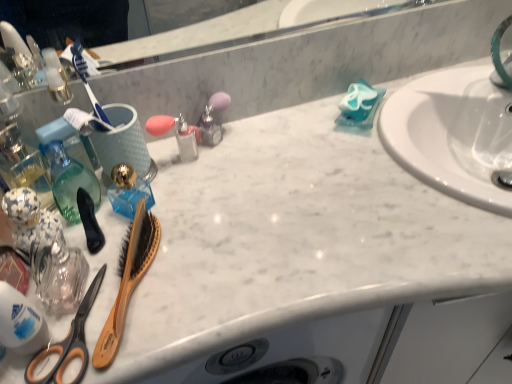
Describe the element at coordinates (213, 119) in the screenshot. The height and width of the screenshot is (384, 512). I see `translucent purple bottle at center` at that location.

The height and width of the screenshot is (384, 512). What do you see at coordinates (68, 334) in the screenshot?
I see `orange-handled scissors at lower left` at bounding box center [68, 334].

Locate an element on the screen. The width and height of the screenshot is (512, 384). translucent plastic bottle at lower left, the first cleaning product positioned from the left is located at coordinates (20, 322).

How much space does blue matte soap at upper right, which appears as the 1th cleaning product when viewed from the back, occupy horizontally?

blue matte soap at upper right, which appears as the 1th cleaning product when viewed from the back, is 5.23 inches in width.

The width and height of the screenshot is (512, 384). Identify the location of translucent purple bottle at center. (213, 119).

Is the position of translucent blue glass at center more distant than that of translucent plastic bottle at lower left, arranged as the 2th cleaning product when viewed from the back?

That is True.

Is translucent blue glass at center inside the boundaries of translucent plastic bottle at lower left, positioned as the 1th cleaning product in bottom-to-top order, or outside?

The correct answer is: outside.

Is translucent blue glass at center far from translucent plastic bottle at lower left, positioned as the 1th cleaning product in bottom-to-top order?

Actually, translucent blue glass at center and translucent plastic bottle at lower left, positioned as the 1th cleaning product in bottom-to-top order, are a little close together.

Considering the relative positions of translucent blue glass at center and translucent plastic bottle at lower left, the first cleaning product positioned from the left, in the image provided, is translucent blue glass at center to the left of translucent plastic bottle at lower left, the first cleaning product positioned from the left, from the viewer's perspective?

No.

From a real-world perspective, is wooden bristle brush at left, which ranks as the 2th brush in left-to-right order, positioned under translucent plastic bottle at lower left, acting as the first cleaning product starting from the front, based on gravity?

Correct, in the physical world, wooden bristle brush at left, which ranks as the 2th brush in left-to-right order, is lower than translucent plastic bottle at lower left, acting as the first cleaning product starting from the front.

From the image's perspective, does wooden bristle brush at left, which ranks as the 2th brush in left-to-right order, appear lower than translucent plastic bottle at lower left, arranged as the 2th cleaning product when viewed from the back?

Actually, wooden bristle brush at left, which ranks as the 2th brush in left-to-right order, appears above translucent plastic bottle at lower left, arranged as the 2th cleaning product when viewed from the back, in the image.

Considering the positions of point (120, 311) and point (41, 344), is point (120, 311) closer or farther from the camera than point (41, 344)?

Clearly, point (120, 311) is more distant from the camera than point (41, 344).

Which of these two, wooden bristle brush at left, the first brush when ordered from right to left, or translucent plastic bottle at lower left, which is counted as the 2th cleaning product, starting from the right, is bigger?

Bigger between the two is wooden bristle brush at left, the first brush when ordered from right to left.

Does point (18, 308) come farther from viewer compared to point (358, 123)?

No, (18, 308) is in front of (358, 123).

Is translucent plastic bottle at lower left, acting as the first cleaning product starting from the front, in contact with blue matte soap at upper right, the 1th cleaning product positioned from the top?

No, translucent plastic bottle at lower left, acting as the first cleaning product starting from the front, is not making contact with blue matte soap at upper right, the 1th cleaning product positioned from the top.

Who is smaller, translucent plastic bottle at lower left, arranged as the 2th cleaning product when viewed from the back, or blue matte soap at upper right, which appears as the 1th cleaning product when viewed from the back?

With smaller size is translucent plastic bottle at lower left, arranged as the 2th cleaning product when viewed from the back.

From a real-world perspective, is translucent blue glass at center under wooden bristle brush at left, which ranks as the 2th brush in left-to-right order?

Actually, translucent blue glass at center is physically above wooden bristle brush at left, which ranks as the 2th brush in left-to-right order, in the real world.

From the image's perspective, which is below, translucent blue glass at center or wooden bristle brush at left, the first brush when ordered from right to left?

From the image's view, wooden bristle brush at left, the first brush when ordered from right to left, is below.

Considering the sizes of objects translucent blue glass at center and wooden bristle brush at left, which ranks as the 2th brush in left-to-right order, in the image provided, who is smaller, translucent blue glass at center or wooden bristle brush at left, which ranks as the 2th brush in left-to-right order,?

With smaller size is translucent blue glass at center.

Which of these two, translucent blue glass at center or wooden bristle brush at left, the first brush when ordered from right to left, stands shorter?

With less height is wooden bristle brush at left, the first brush when ordered from right to left.

Which is behind, point (39, 358) or point (353, 121)?

The point (353, 121) is farther from the camera.

Does orange-handled scissors at lower left have a lesser height compared to blue matte soap at upper right, which appears as the 1th cleaning product when viewed from the back?

Indeed, orange-handled scissors at lower left has a lesser height compared to blue matte soap at upper right, which appears as the 1th cleaning product when viewed from the back.

Where is `scissors on the left of the blue matte soap at upper right, the second cleaning product from the bottom`? scissors on the left of the blue matte soap at upper right, the second cleaning product from the bottom is located at coordinates (68, 334).

Is wooden bristle brush at left, which ranks as the 2th brush in left-to-right order, facing away from translucent glass bottle at left?

Yes.

Considering the relative positions of wooden bristle brush at left, the first brush when ordered from right to left, and translucent glass bottle at left in the image provided, is wooden bristle brush at left, the first brush when ordered from right to left, to the right of translucent glass bottle at left from the viewer's perspective?

Yes, wooden bristle brush at left, the first brush when ordered from right to left, is to the right of translucent glass bottle at left.

Image resolution: width=512 pixels, height=384 pixels. What are the coordinates of `brush that is the 2nd object directly below the translucent glass bottle at left (from a real-world perspective)` in the screenshot? It's located at 128,280.

Looking at the image, does wooden bristle brush at left, the first brush when ordered from right to left, seem bigger or smaller compared to translucent glass bottle at left?

In the image, wooden bristle brush at left, the first brush when ordered from right to left, appears to be larger than translucent glass bottle at left.

Can translucent plastic bottle at lower left, which is counted as the 2th cleaning product, starting from the right, be found inside orange-handled scissors at lower left?

No, translucent plastic bottle at lower left, which is counted as the 2th cleaning product, starting from the right, is not surrounded by orange-handled scissors at lower left.

Could you measure the distance between orange-handled scissors at lower left and translucent plastic bottle at lower left, which is counted as the 2th cleaning product, starting from the right?

orange-handled scissors at lower left and translucent plastic bottle at lower left, which is counted as the 2th cleaning product, starting from the right, are 1.90 inches apart from each other.

Which object is further away from the camera, orange-handled scissors at lower left or translucent plastic bottle at lower left, arranged as the 2th cleaning product when viewed from the back?

orange-handled scissors at lower left is further away from the camera.

Considering the relative positions of orange-handled scissors at lower left and translucent plastic bottle at lower left, which ranks as the 2th cleaning product in top-to-bottom order, in the image provided, is orange-handled scissors at lower left to the left of translucent plastic bottle at lower left, which ranks as the 2th cleaning product in top-to-bottom order, from the viewer's perspective?

No.

Where is `mouthwash located underneath the translucent plastic bottle at lower left, acting as the first cleaning product starting from the front (from a real-world perspective)`? This screenshot has width=512, height=384. mouthwash located underneath the translucent plastic bottle at lower left, acting as the first cleaning product starting from the front (from a real-world perspective) is located at coordinates tap(128, 191).

Where is `cleaning product located on the left of wooden bristle brush at left, the first brush when ordered from right to left`? This screenshot has width=512, height=384. cleaning product located on the left of wooden bristle brush at left, the first brush when ordered from right to left is located at coordinates (20, 322).

Looking at this image, looking at the image, which one is located closer to wooden bristle brush at left, which ranks as the 2th brush in left-to-right order, translucent purple bottle at center or translucent blue glass at center?

Among the two, translucent blue glass at center is located nearer to wooden bristle brush at left, which ranks as the 2th brush in left-to-right order.

Considering their positions, is black rubber brush at left, which is the first brush in left-to-right order, positioned closer to blue matte soap at upper right, the 1th cleaning product positioned from the top, than wooden bristle brush at left, which ranks as the 2th brush in left-to-right order?

Based on the image, wooden bristle brush at left, which ranks as the 2th brush in left-to-right order, appears to be nearer to blue matte soap at upper right, the 1th cleaning product positioned from the top.

Based on their spatial positions, is blue matte soap at upper right, which appears as the 1th cleaning product when viewed from the back, or translucent blue glass at center closer to orange-handled scissors at lower left?

translucent blue glass at center lies closer to orange-handled scissors at lower left than the other object.

From the image, which object appears to be farther from wooden bristle brush at left, which ranks as the 2th brush in left-to-right order, translucent blue glass at center or orange-handled scissors at lower left?

translucent blue glass at center lies further to wooden bristle brush at left, which ranks as the 2th brush in left-to-right order, than the other object.

Based on their spatial positions, is translucent plastic bottle at lower left, arranged as the 2th cleaning product when viewed from the back, or wooden bristle brush at left, the first brush when ordered from right to left, closer to orange-handled scissors at lower left?

translucent plastic bottle at lower left, arranged as the 2th cleaning product when viewed from the back.

When comparing their distances from black rubber brush at left, which is the first brush in left-to-right order, does translucent blue glass at center or blue matte soap at upper right, the second cleaning product from the bottom, seem further?

Based on the image, blue matte soap at upper right, the second cleaning product from the bottom, appears to be further to black rubber brush at left, which is the first brush in left-to-right order.

Looking at the image, which one is located further to translucent glass bottle at left, blue matte soap at upper right, the 1th cleaning product positioned from the top, or translucent blue glass at center?

Based on the image, blue matte soap at upper right, the 1th cleaning product positioned from the top, appears to be further to translucent glass bottle at left.

Based on the photo, which object lies further to the anchor point translucent blue glass at center, blue matte soap at upper right, which is counted as the second cleaning product, starting from the left, or black rubber brush at left, the second brush positioned from the right?

The object further to translucent blue glass at center is blue matte soap at upper right, which is counted as the second cleaning product, starting from the left.

The height and width of the screenshot is (384, 512). In order to click on mouthwash located between translucent plastic bottle at lower left, arranged as the 2th cleaning product when viewed from the back, and blue matte soap at upper right, the first cleaning product from the right, in the left-right direction in this screenshot , I will do `click(128, 191)`.

At what (x,y) coordinates should I click in order to perform the action: click on mouthwash between translucent glass bottle at left and orange-handled scissors at lower left vertically. Please return your answer as a coordinate pair (x, y). This screenshot has height=384, width=512. Looking at the image, I should click on (128, 191).

The height and width of the screenshot is (384, 512). What are the coordinates of `bottle located between translucent plastic bottle at lower left, arranged as the 2th cleaning product when viewed from the back, and translucent purple bottle at center in the depth direction` in the screenshot? It's located at (70, 181).

The image size is (512, 384). In order to click on cleaning product between translucent glass bottle at left and orange-handled scissors at lower left in the vertical direction in this screenshot , I will do `click(20, 322)`.